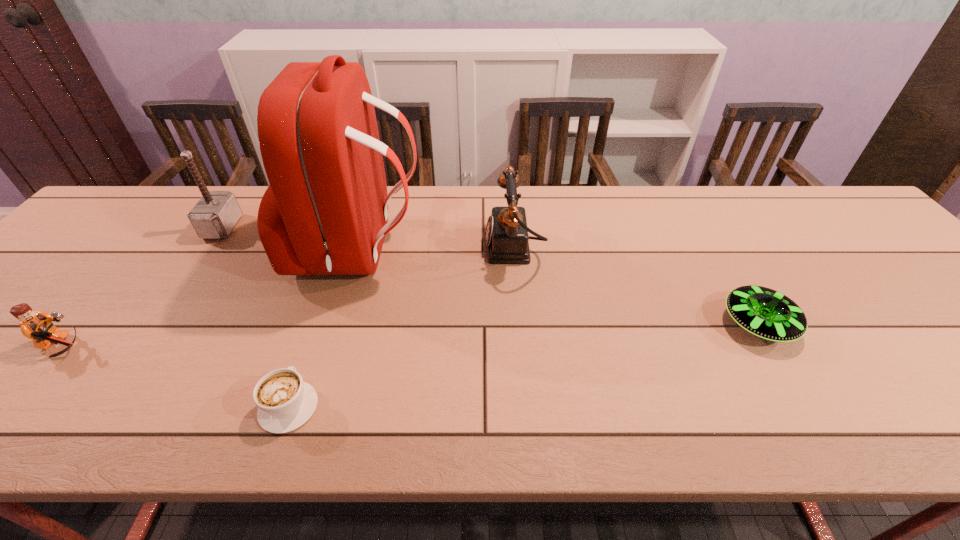
Identify which object is located as the fourth nearest to the saucer. Please provide its 2D coordinates. Your answer should be formatted as a tuple, i.e. [(x, y)], where the tuple contains the x and y coordinates of a point satisfying the conditions above.

[(214, 216)]

The width and height of the screenshot is (960, 540). I want to click on vacant space that satisfies the following two spatial constraints: 1. to the right of the nearest object's handle; 2. for striking with the head of the fifth object from right to left, so click(350, 227).

In order to click on vacant space that satisfies the following two spatial constraints: 1. to the right of the cappuccino's handle; 2. holding a crossbow in the hands of the fourth tallest object in this screenshot , I will do `click(309, 347)`.

Where is `blank area in the image that satisfies the following two spatial constraints: 1. for striking with the head of the second object from left to right; 2. to the right of the cappuccino's handle`? blank area in the image that satisfies the following two spatial constraints: 1. for striking with the head of the second object from left to right; 2. to the right of the cappuccino's handle is located at coordinates (101, 406).

The width and height of the screenshot is (960, 540). I want to click on free point that satisfies the following two spatial constraints: 1. for striking with the head of the second object from left to right; 2. on the right side of the rightmost object, so click(x=156, y=325).

The image size is (960, 540). Identify the location of vacant region that satisfies the following two spatial constraints: 1. for striking with the head of the fifth object from right to left; 2. on the right side of the rightmost object. (156, 325).

This screenshot has width=960, height=540. Identify the location of vacant region that satisfies the following two spatial constraints: 1. to the right of the shortest object's handle; 2. for striking with the head of the second object from left to right. (350, 227).

You are a GUI agent. You are given a task and a screenshot of the screen. Output one action in this format:
    pyautogui.click(x=<x>, y=<y>)
    Task: Click on the free spot that satisfies the following two spatial constraints: 1. holding a crossbow in the hands of the Lego; 2. to the right of the shortest object's handle
    
    Given the screenshot: What is the action you would take?
    pyautogui.click(x=14, y=406)